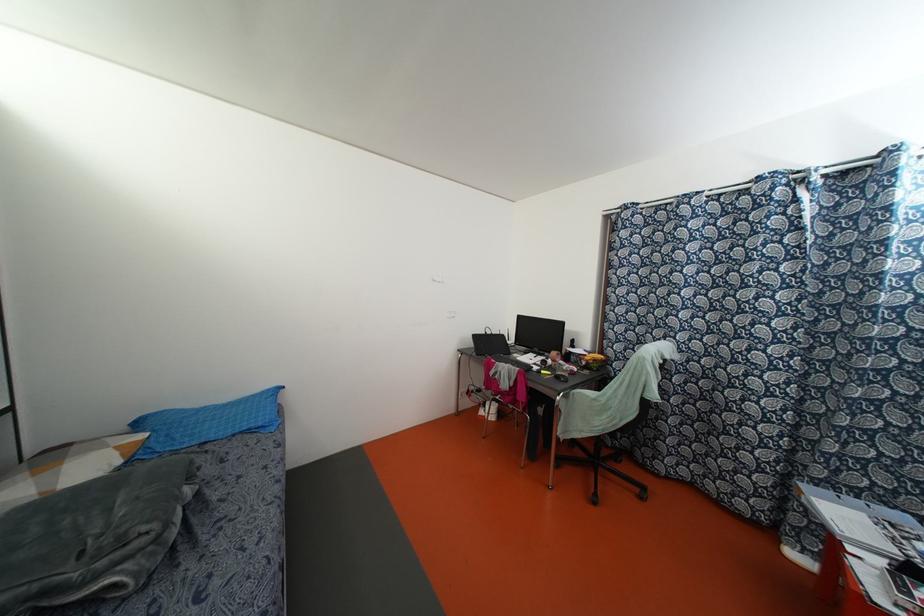
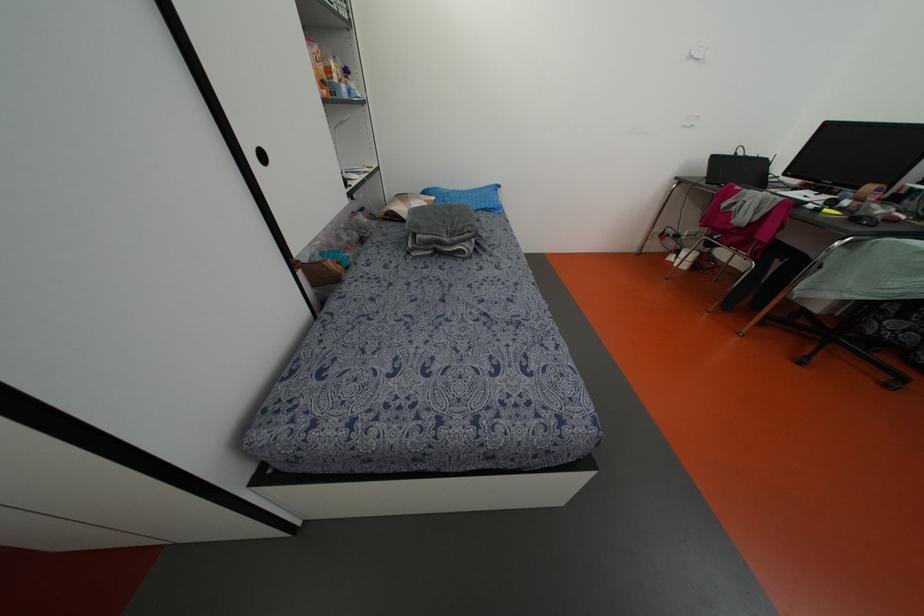
Find the pixel in the second image that matches the point at 488,331 in the first image.

(739, 153)